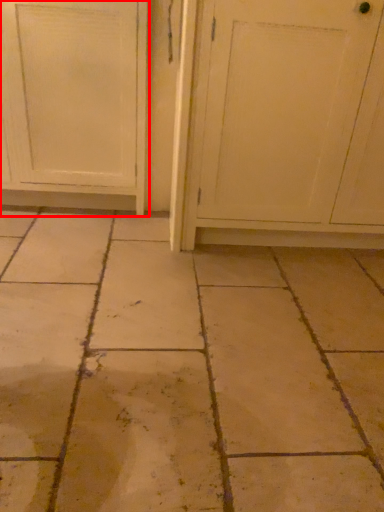
Question: In this image, where is door (annotated by the red box) located relative to screen door?

Choices:
 (A) right
 (B) left

Answer: (B)